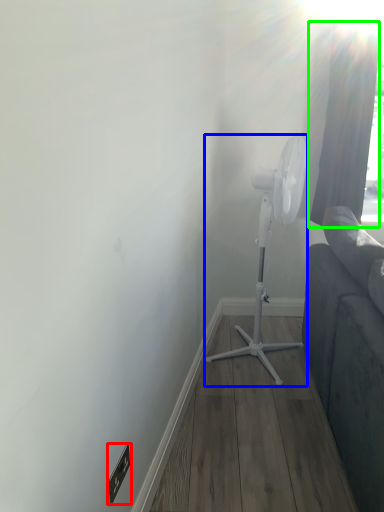
Question: Which object is positioned farthest from electric outlet (highlighted by a red box)? Select from mechanical fan (highlighted by a blue box) and curtain (highlighted by a green box).

Choices:
 (A) mechanical fan
 (B) curtain

Answer: (B)